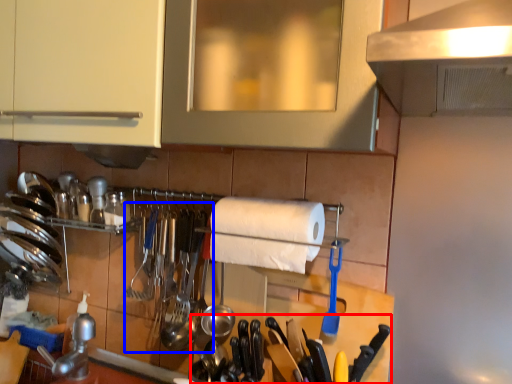
Question: Among these objects, which one is farthest to the camera, cutlery (highlighted by a red box) or silverware (highlighted by a blue box)?

Choices:
 (A) cutlery
 (B) silverware

Answer: (B)